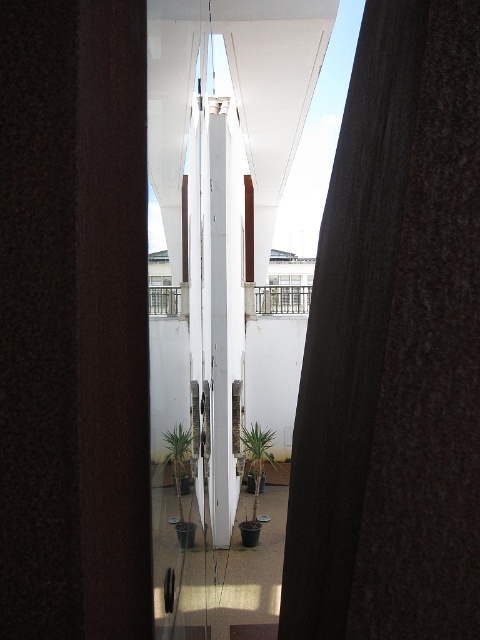
You are standing inside the room looking out the window. You notice the green leafy plant at center and the white metal railing at center. Which object is wider?

The green leafy plant at center is wider than the white metal railing at center according to the description.

You are standing inside a room and looking through the window at the two plants on the balcony. Which plant is taller, the green leafy plant at center or the green matte plant at center?

The green leafy plant at center is much taller than the green matte plant at center.